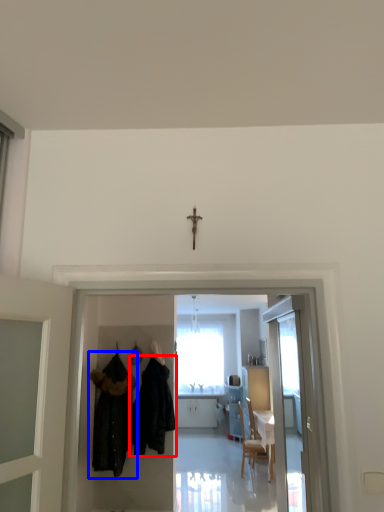
Question: Which point is closer to the camera, fancy dress (highlighted by a red box) or fancy dress (highlighted by a blue box)?

Choices:
 (A) fancy dress
 (B) fancy dress

Answer: (B)